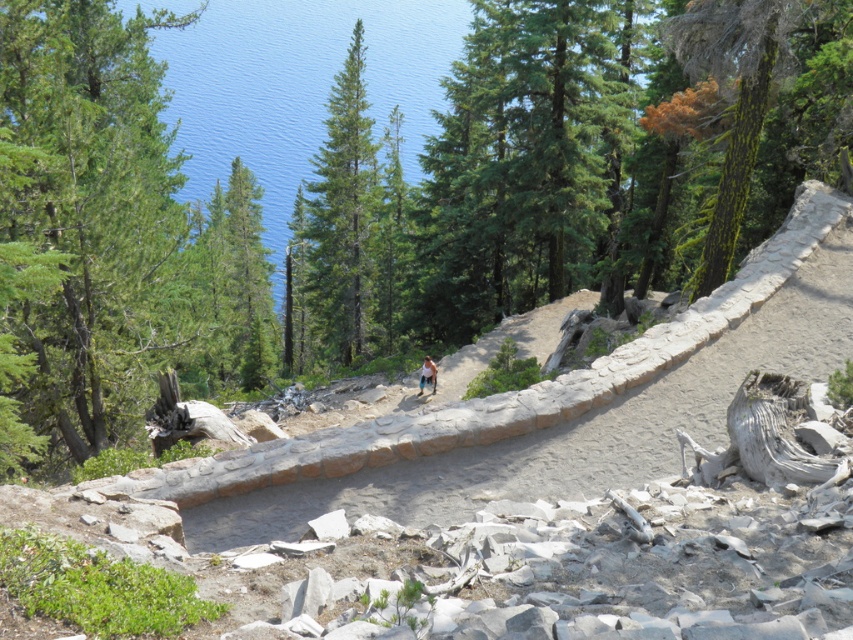
You are standing at the start of the hiking trail and see the green textured tree at upper left. If you want to take a photo of it with your camera, which has a maximum zoom range of 10 meters, will you be able to capture the entire tree in the frame without moving closer?

The green textured tree at upper left is 10.94 meters away from the camera. Since the camera can only zoom up to 10 meters, you won not be able to capture the entire tree in the frame without moving closer.

You are a hiker standing at the start of the trail. You notice a green textured tree at upper left and light blue denim shorts at center in the distance. Which object is positioned more to the left side of your view?

The green textured tree at upper left is positioned more to the left side of your view than the light blue denim shorts at center because it is located to the left of it according to the description.